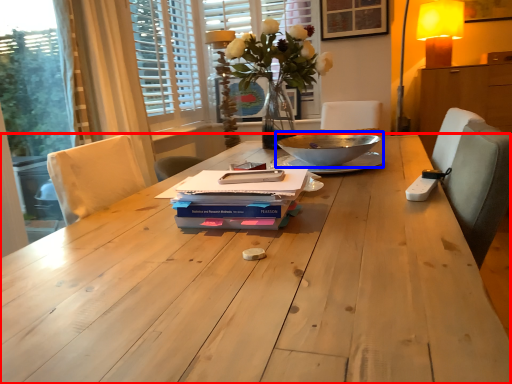
Question: Which object is closer to the camera taking this photo, table (highlighted by a red box) or bowl (highlighted by a blue box)?

Choices:
 (A) table
 (B) bowl

Answer: (A)